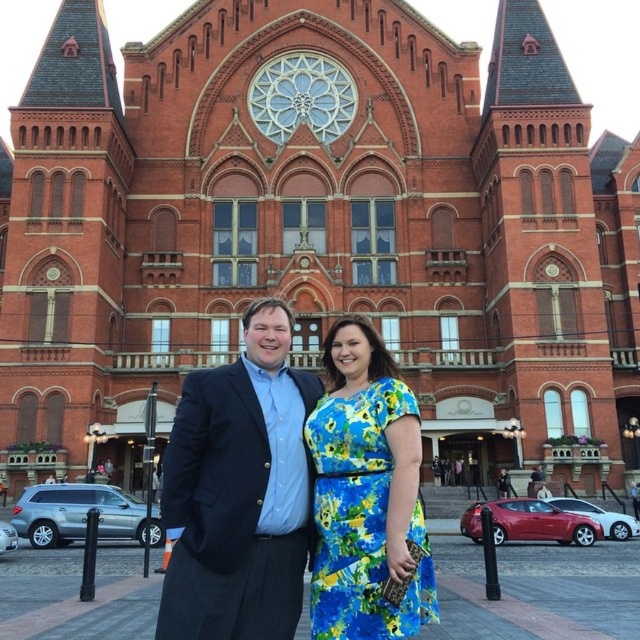
Between matte black suit at center and floral print fabric dress at center, which one is positioned higher?

matte black suit at center is above.

Who is more forward, (269, 336) or (381, 378)?

Positioned in front is point (381, 378).

Where is `matte black suit at center`? This screenshot has height=640, width=640. matte black suit at center is located at coordinates (240, 492).